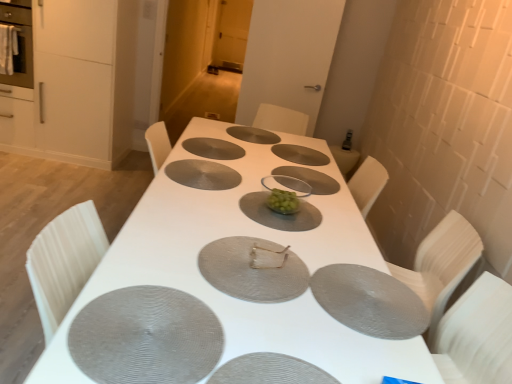
Image resolution: width=512 pixels, height=384 pixels. Identify the location of free space above metallic silver pizza pan at center, the 4th pizza pan viewed from the front (from a real-world perspective). (251, 260).